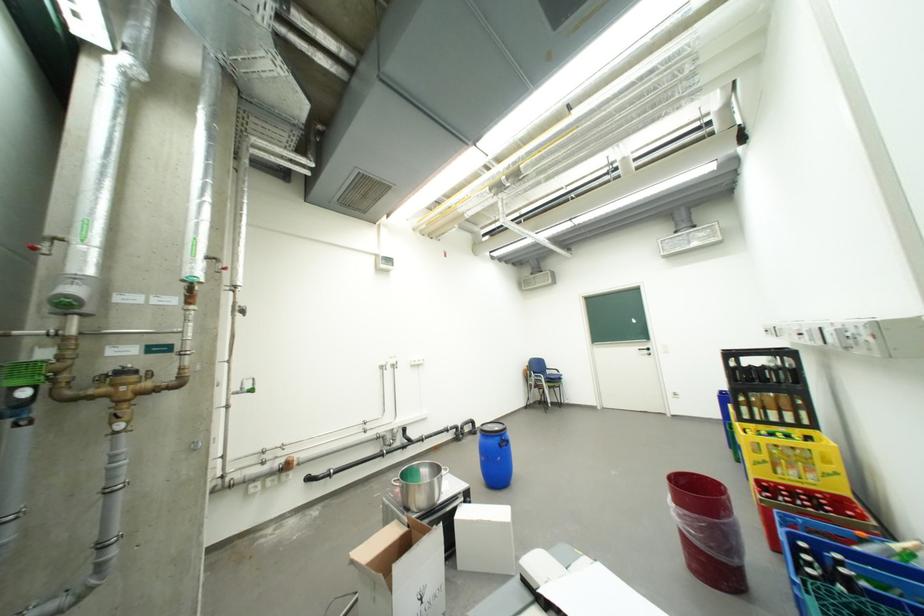
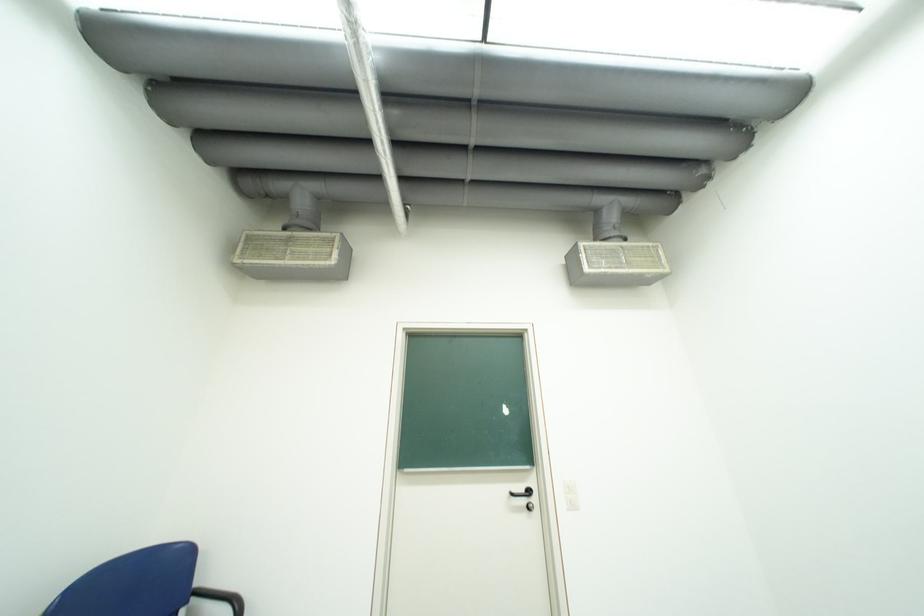
Find the pixel in the second image that matches the point at 650,351 in the first image.

(523, 495)